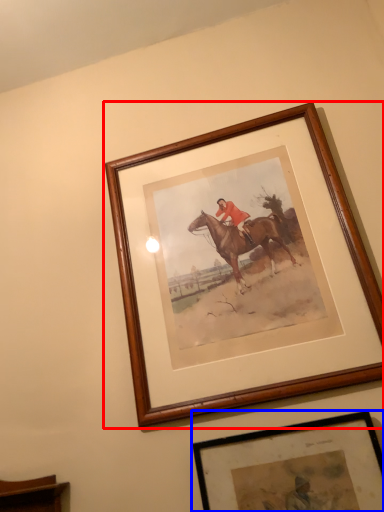
Question: Among these objects, which one is nearest to the camera, picture frame (highlighted by a red box) or picture frame (highlighted by a blue box)?

Choices:
 (A) picture frame
 (B) picture frame

Answer: (B)